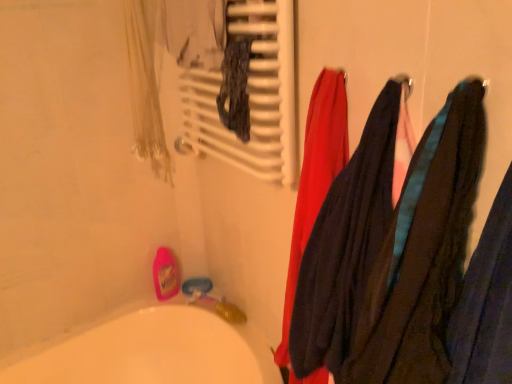
Question: Can dark blue fabric at right be found inside white matte radiator at upper center?

Choices:
 (A) yes
 (B) no

Answer: (B)

Question: Can you confirm if white matte radiator at upper center is positioned to the left of dark blue fabric at right?

Choices:
 (A) yes
 (B) no

Answer: (A)

Question: From a real-world perspective, is white matte radiator at upper center positioned under dark blue fabric at right based on gravity?

Choices:
 (A) no
 (B) yes

Answer: (A)

Question: Is white matte radiator at upper center positioned behind dark blue fabric at right?

Choices:
 (A) no
 (B) yes

Answer: (B)

Question: Considering the relative sizes of white matte radiator at upper center and dark blue fabric at right in the image provided, is white matte radiator at upper center shorter than dark blue fabric at right?

Choices:
 (A) yes
 (B) no

Answer: (A)

Question: Is white matte radiator at upper center smaller than dark blue fabric at right?

Choices:
 (A) no
 (B) yes

Answer: (A)

Question: From a real-world perspective, is dark blue fabric at right on top of white matte radiator at upper center?

Choices:
 (A) yes
 (B) no

Answer: (B)

Question: Can you confirm if dark blue fabric at right is shorter than white matte radiator at upper center?

Choices:
 (A) no
 (B) yes

Answer: (A)

Question: Does dark blue fabric at right lie behind white matte radiator at upper center?

Choices:
 (A) no
 (B) yes

Answer: (A)

Question: Does dark blue fabric at right have a greater width compared to white matte radiator at upper center?

Choices:
 (A) yes
 (B) no

Answer: (A)

Question: Is dark blue fabric at right next to white matte radiator at upper center?

Choices:
 (A) no
 (B) yes

Answer: (A)

Question: Can you confirm if dark blue fabric at right is positioned to the right of white matte radiator at upper center?

Choices:
 (A) no
 (B) yes

Answer: (B)

Question: Considering the positions of point (223, 139) and point (420, 246), is point (223, 139) closer or farther from the camera than point (420, 246)?

Choices:
 (A) farther
 (B) closer

Answer: (A)